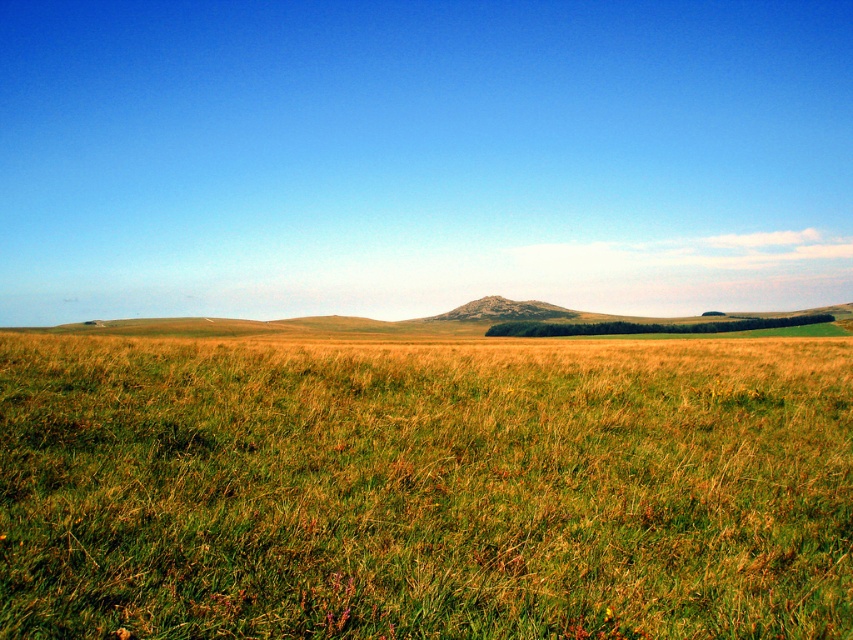
From the picture: Can you confirm if green grassy field at center is positioned below rustic granite mountain at center?

Yes.

Who is positioned more to the left, green grassy field at center or rustic granite mountain at center?

From the viewer's perspective, green grassy field at center appears more on the left side.

The width and height of the screenshot is (853, 640). What do you see at coordinates (425, 486) in the screenshot?
I see `green grassy field at center` at bounding box center [425, 486].

The image size is (853, 640). In order to click on green grassy field at center in this screenshot , I will do `click(425, 486)`.